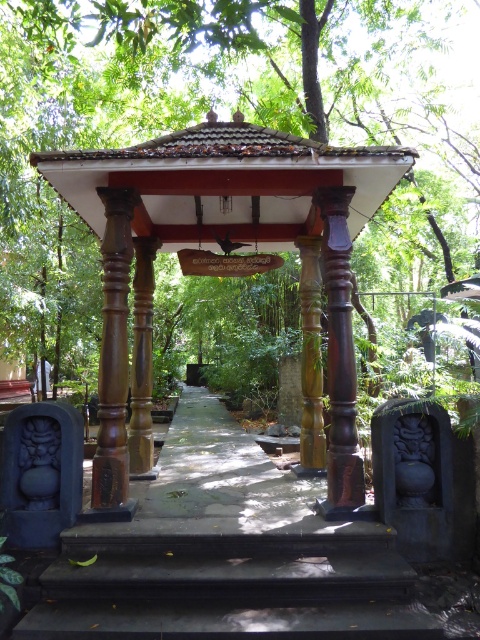
Does brown polished wood gazebo at center have a greater height compared to black stone stairs at center?

Yes.

Can you confirm if brown polished wood gazebo at center is positioned to the right of black stone stairs at center?

No, brown polished wood gazebo at center is not to the right of black stone stairs at center.

Locate an element on the screen. brown polished wood gazebo at center is located at coordinates (226, 259).

This screenshot has width=480, height=640. I want to click on brown polished wood gazebo at center, so coord(226,259).